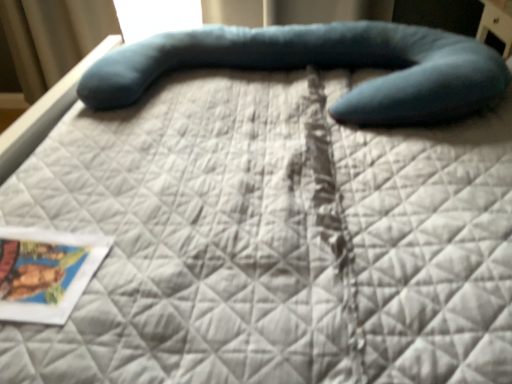
Question: Is teal fabric bean bag chair at center positioned beyond the bounds of matte paper postcard at lower left?

Choices:
 (A) yes
 (B) no

Answer: (A)

Question: Is teal fabric bean bag chair at center not near matte paper postcard at lower left?

Choices:
 (A) yes
 (B) no

Answer: (B)

Question: Could you tell me if teal fabric bean bag chair at center is facing matte paper postcard at lower left?

Choices:
 (A) no
 (B) yes

Answer: (A)

Question: Does teal fabric bean bag chair at center have a greater width compared to matte paper postcard at lower left?

Choices:
 (A) yes
 (B) no

Answer: (A)

Question: Is matte paper postcard at lower left inside teal fabric bean bag chair at center?

Choices:
 (A) no
 (B) yes

Answer: (A)

Question: Considering the relative sizes of teal fabric bean bag chair at center and matte paper postcard at lower left in the image provided, is teal fabric bean bag chair at center taller than matte paper postcard at lower left?

Choices:
 (A) no
 (B) yes

Answer: (B)

Question: Can you confirm if matte paper postcard at lower left is positioned to the left of teal fabric bean bag chair at center?

Choices:
 (A) no
 (B) yes

Answer: (B)

Question: Is matte paper postcard at lower left in contact with teal fabric bean bag chair at center?

Choices:
 (A) no
 (B) yes

Answer: (A)

Question: Can you confirm if matte paper postcard at lower left is shorter than teal fabric bean bag chair at center?

Choices:
 (A) yes
 (B) no

Answer: (A)

Question: From a real-world perspective, is matte paper postcard at lower left over teal fabric bean bag chair at center?

Choices:
 (A) no
 (B) yes

Answer: (A)

Question: Can you confirm if matte paper postcard at lower left is smaller than teal fabric bean bag chair at center?

Choices:
 (A) yes
 (B) no

Answer: (A)

Question: Is matte paper postcard at lower left oriented away from teal fabric bean bag chair at center?

Choices:
 (A) yes
 (B) no

Answer: (B)

Question: From the image's perspective, relative to matte paper postcard at lower left, is teal fabric bean bag chair at center above or below?

Choices:
 (A) below
 (B) above

Answer: (B)